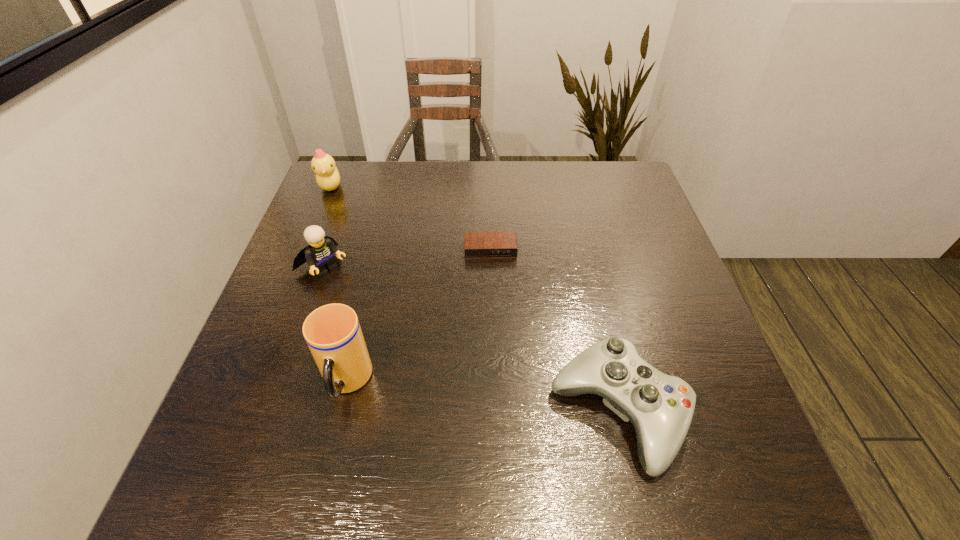
The width and height of the screenshot is (960, 540). I want to click on control that is at the near edge, so click(x=660, y=407).

Where is `duckling at the left edge`? duckling at the left edge is located at coordinates (327, 175).

Image resolution: width=960 pixels, height=540 pixels. What are the coordinates of `Lego at the left edge` in the screenshot? It's located at (319, 254).

Image resolution: width=960 pixels, height=540 pixels. Identify the location of object that is positioned at the right edge. (660, 407).

Find the location of a particular element. object present at the far left corner is located at coordinates (327, 175).

Where is `object situated at the near right corner`? The height and width of the screenshot is (540, 960). object situated at the near right corner is located at coordinates pos(660,407).

I want to click on vacant space at the far edge, so click(x=433, y=198).

The height and width of the screenshot is (540, 960). In order to click on free space at the left edge of the desktop in this screenshot , I will do `click(357, 234)`.

This screenshot has height=540, width=960. What are the coordinates of `blank space at the right edge of the desktop` in the screenshot? It's located at (636, 228).

This screenshot has width=960, height=540. In the image, there is a desktop. In order to click on vacant space at the far right corner in this screenshot , I will do 624,169.